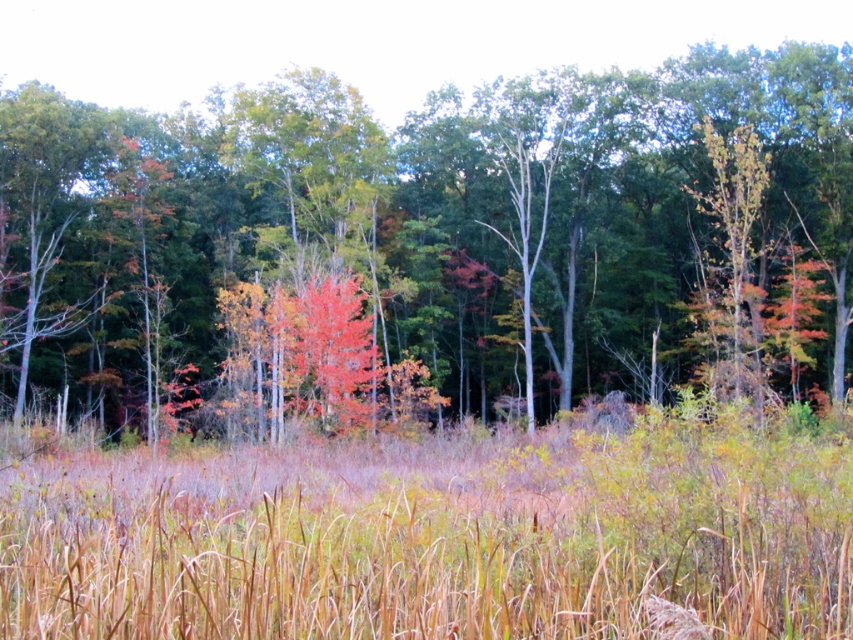
From the picture: You are a hiker trying to navigate through the forest. You see the brown dry grass at center and the green matte tree at center. Which one is closer to the ground?

The brown dry grass at center is closer to the ground because it is positioned below the green matte tree at center.

You are a hiker trying to navigate through the field of brown dry grass at center. There is a smooth red tree at center nearby. Which direction should you walk to avoid the tree?

The smooth red tree at center is positioned on the right side of brown dry grass at center. To avoid the tree, you should walk to the left side of the brown dry grass at center.

Looking at this image, you are planning to place a bench between the smooth red tree at center and the green matte tree at center. Given their widths, which tree will require more space on the bench side?

The smooth red tree at center has a larger width than the green matte tree at center, so it will require more space on the bench side.